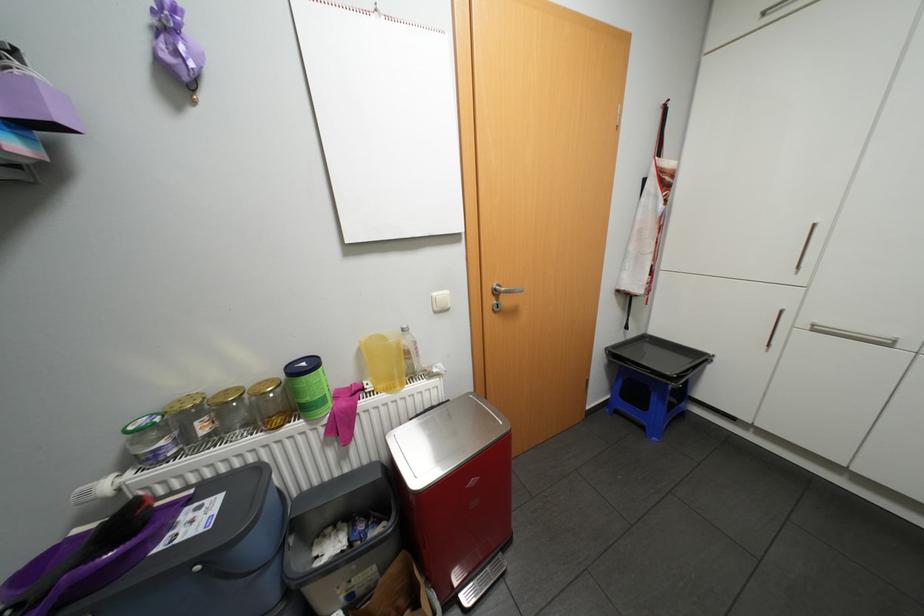
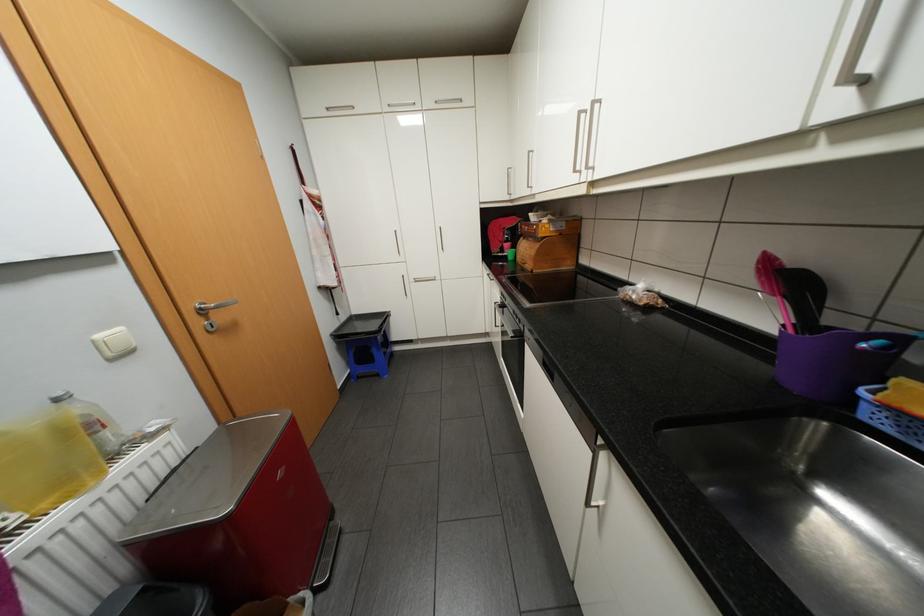
Locate, in the second image, the point that corresponds to (443,293) in the first image.

(106, 334)